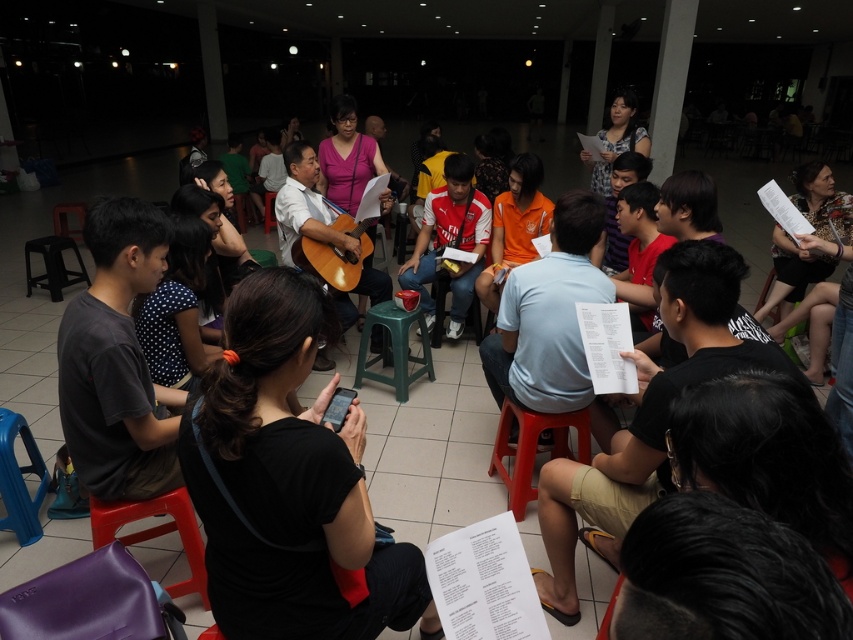
You are organizing a small music workshop in the hall and need to place a purple leather bag at lower left and a black plastic stool at lower left. Since space is limited, can you fit both items in the lower left area without overlapping?

The purple leather bag at lower left is smaller than the black plastic stool at lower left, so both items can fit in the lower left area without overlapping as long as there is enough space for the larger black plastic stool.